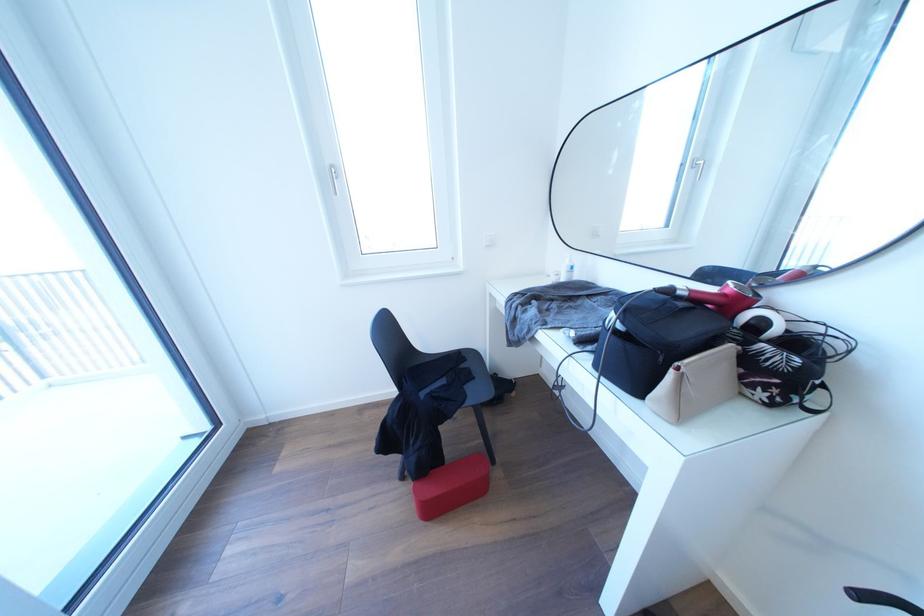
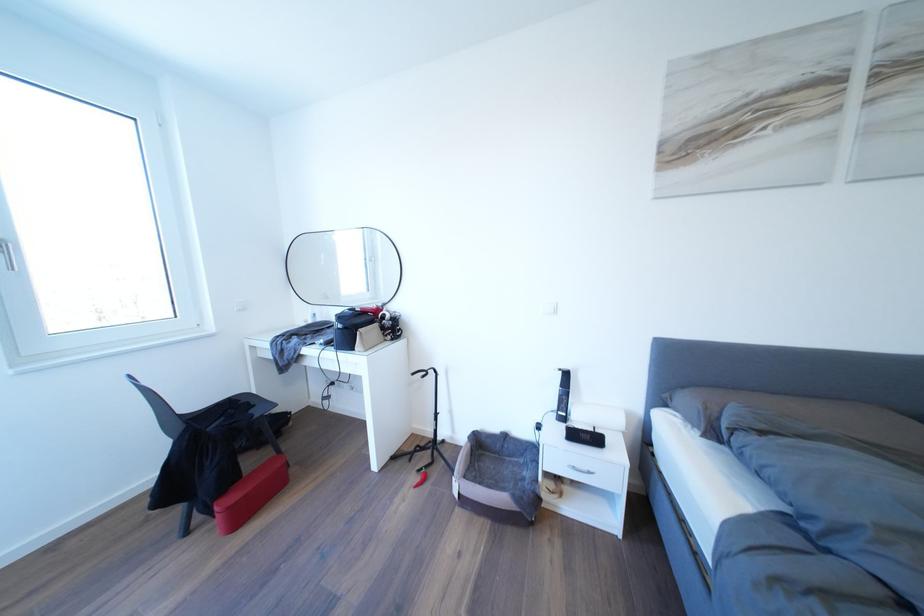
The point at (603, 240) is marked in the first image. Where is the corresponding point in the second image?

(334, 302)